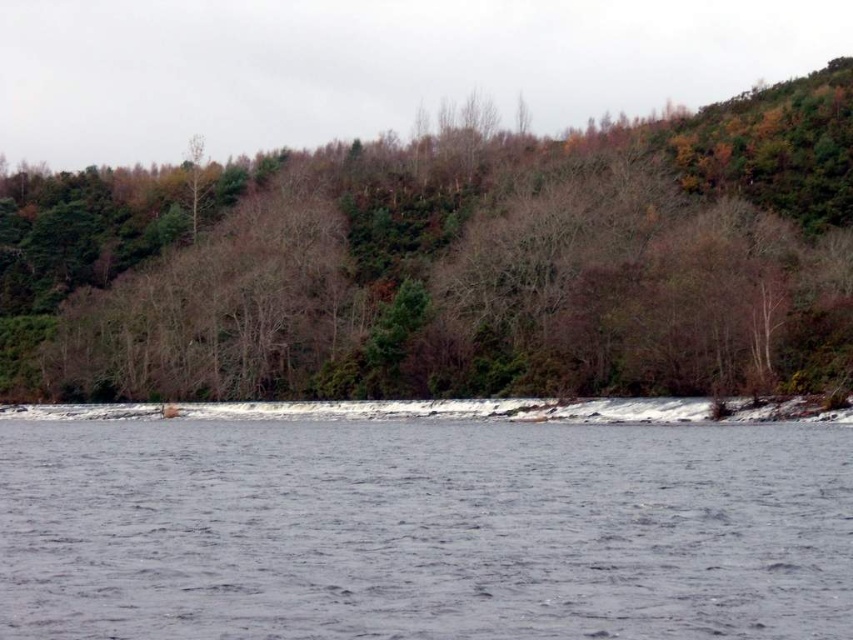
Can you confirm if brown leafless tree at center is bigger than gray water at center?

Indeed, brown leafless tree at center has a larger size compared to gray water at center.

Does brown leafless tree at center appear on the left side of gray water at center?

No, brown leafless tree at center is not to the left of gray water at center.

Which is in front, point (766, 330) or point (198, 576)?

Point (198, 576) is in front.

Image resolution: width=853 pixels, height=640 pixels. I want to click on brown leafless tree at center, so click(456, 264).